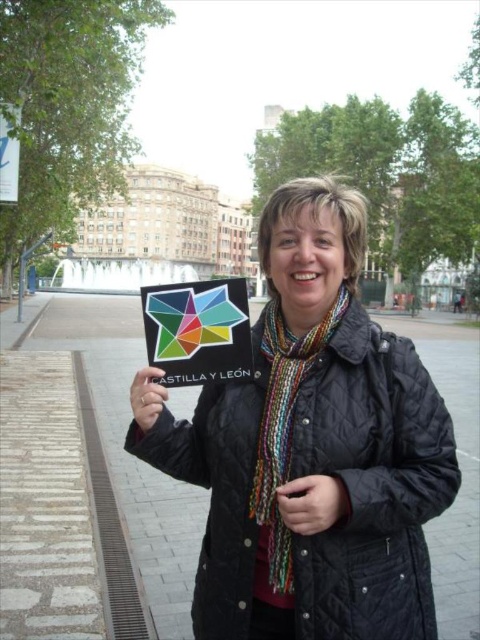
You are a photographer trying to capture the person holding the matte black card at center while ensuring the multicolored scarf at center is visible in the frame. Based on the scene, can you position yourself so that both objects are visible without one blocking the other?

→ The multicolored scarf at center is in front of the matte black card at center, so positioning yourself from an angle where the scarf is not directly overlapping the card would allow both to be visible. Since the scarf is in front, adjusting your camera angle slightly downward or to the side could ensure both are visible without obstruction.

You are a photographer trying to capture a photo of the black quilted jacket at center and the matte plastic sign at center. Which object should you focus on first if you want to ensure both are in frame without moving the camera?

The black quilted jacket at center is much taller than the matte plastic sign at center, so you should focus on the taller jacket first to ensure it fits within the frame before adjusting for the smaller sign.

You are a photographer trying to capture the person in the scene. The multicolored knitted scarf at center and the matte black card at center are both in your viewfinder. Which object should you focus on if you want to emphasize the larger one in the photo?

The multicolored knitted scarf at center is bigger than the matte black card at center, so you should focus on the multicolored knitted scarf at center to emphasize the larger object.